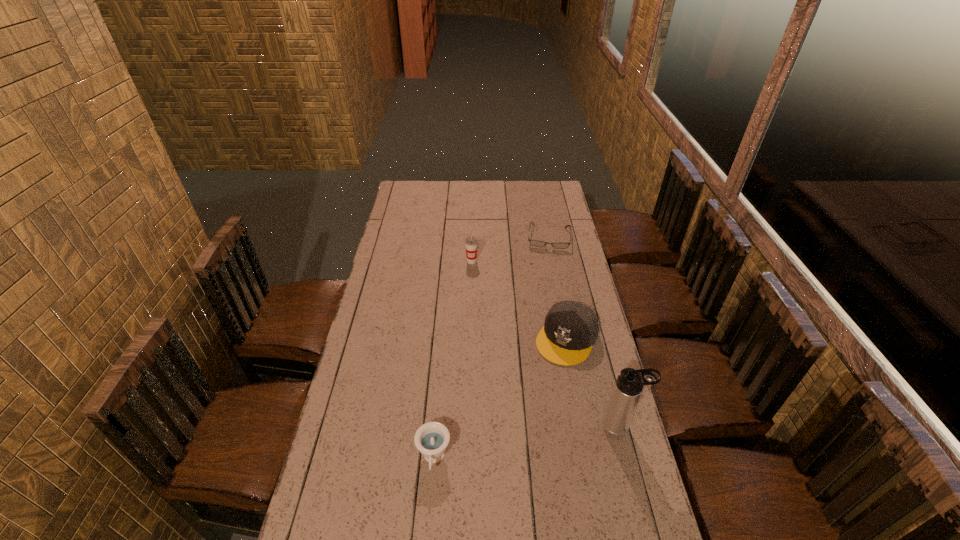
The height and width of the screenshot is (540, 960). What are the coordinates of `spectacles situated at the right edge` in the screenshot? It's located at (535, 243).

Where is `vacant space at the far edge`? The height and width of the screenshot is (540, 960). vacant space at the far edge is located at coordinates (440, 188).

You are a GUI agent. You are given a task and a screenshot of the screen. Output one action in this format:
    pyautogui.click(x=<x>, y=<y>)
    Task: Click on the free space at the left edge of the desktop
    This screenshot has width=960, height=540.
    Given the screenshot: What is the action you would take?
    pyautogui.click(x=375, y=306)

In the image, there is a desktop. At what (x,y) coordinates should I click in order to perform the action: click on free space at the right edge. Please return your answer as a coordinate pair (x, y). Image resolution: width=960 pixels, height=540 pixels. Looking at the image, I should click on (568, 272).

The image size is (960, 540). What are the coordinates of `vacant space at the far right corner` in the screenshot? It's located at (556, 186).

You are a GUI agent. You are given a task and a screenshot of the screen. Output one action in this format:
    pyautogui.click(x=<x>, y=<y>)
    Task: Click on the vacant space at the near right corner of the desktop
    
    Given the screenshot: What is the action you would take?
    [635, 521]

Locate an element on the screen. This screenshot has height=540, width=960. vacant space that's between the shortest object and the third tallest object is located at coordinates (558, 288).

Where is `free point between the teacup and the third tallest object`? free point between the teacup and the third tallest object is located at coordinates (500, 399).

This screenshot has height=540, width=960. I want to click on vacant space in between the third shortest object and the leftmost object, so click(x=500, y=399).

Identify the location of vacant area that lies between the teacup and the cup. The height and width of the screenshot is (540, 960). (453, 360).